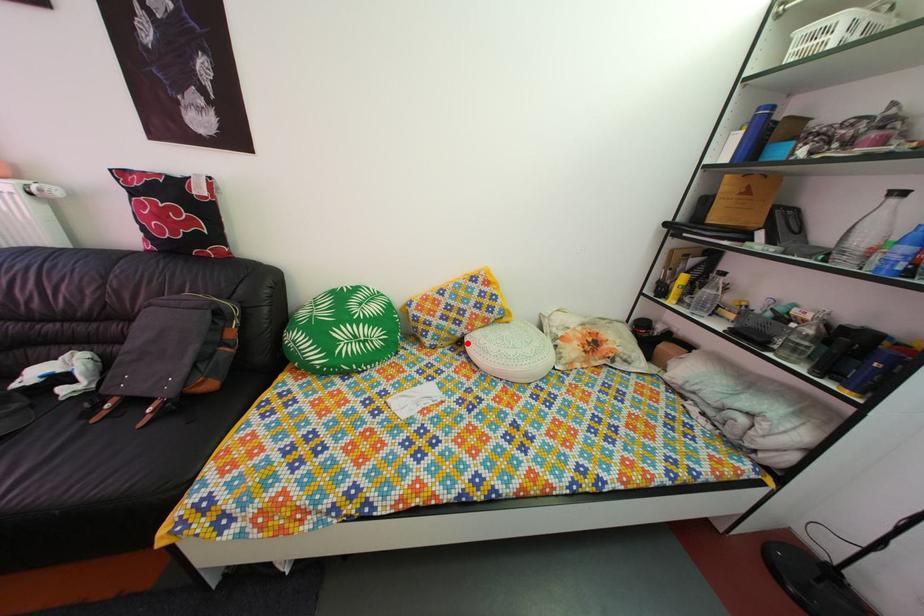
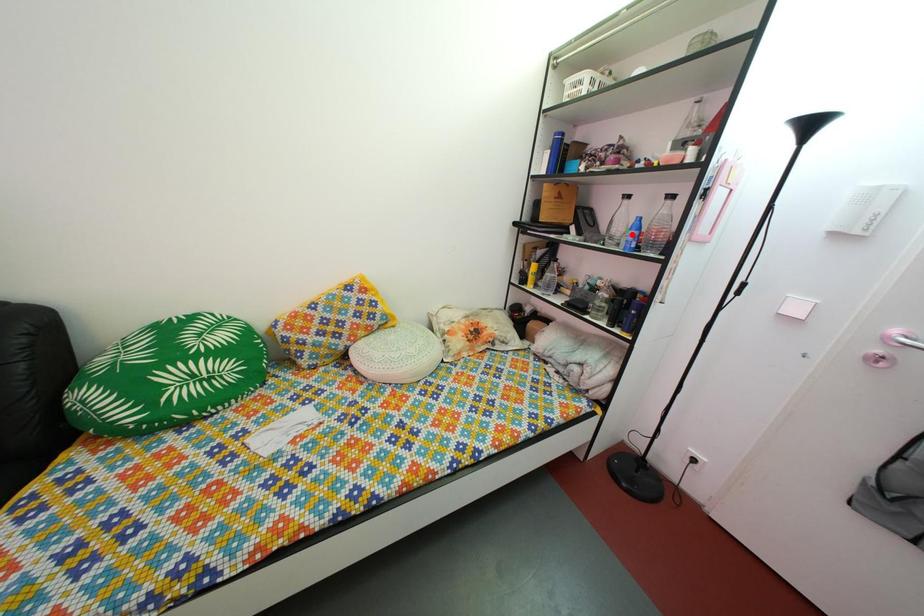
I am providing you with two images of the same scene from different viewpoints. A red point is marked on the first image and another point is marked on the second image. Are the points marked in image1 and image2 representing the same 3D position?

No